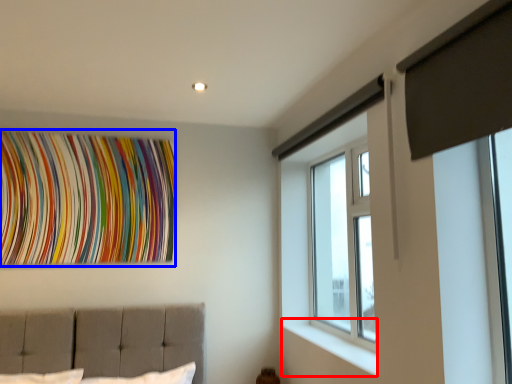
Question: Which point is closer to the camera, window sill (highlighted by a red box) or tapestry (highlighted by a blue box)?

Choices:
 (A) window sill
 (B) tapestry

Answer: (A)